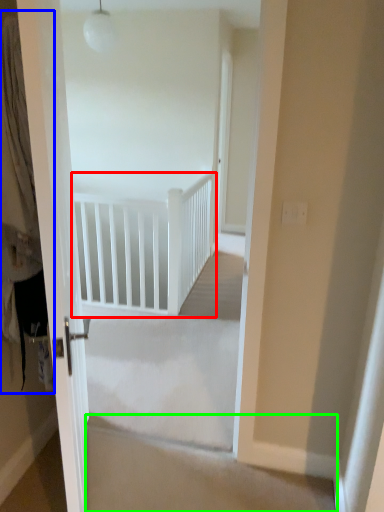
Question: Considering the real-world distances, which object is farthest from rail (highlighted by a red box)? curtain (highlighted by a blue box) or stairwell (highlighted by a green box)?

Choices:
 (A) curtain
 (B) stairwell

Answer: (A)